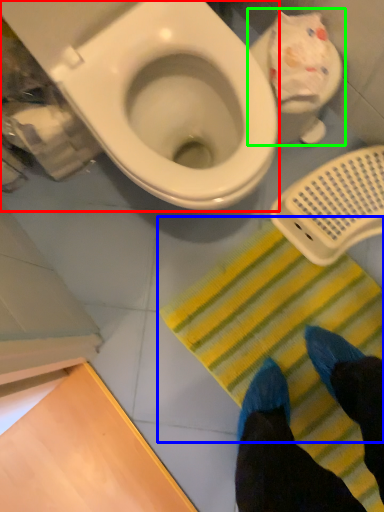
Question: Which is farther away from toilet (highlighted by a red box)? doormat (highlighted by a blue box) or toilet (highlighted by a green box)?

Choices:
 (A) doormat
 (B) toilet

Answer: (A)